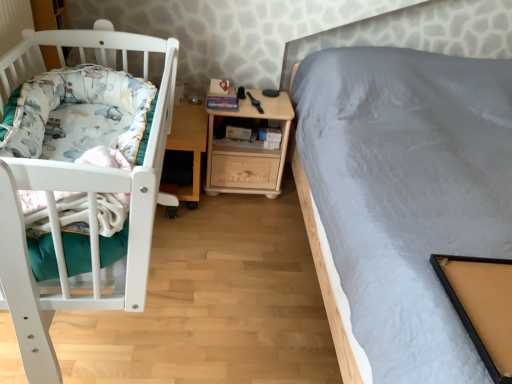
Question: Looking at the image, does white soft blanket at left seem bigger or smaller compared to wooden nightstand at center?

Choices:
 (A) big
 (B) small

Answer: (A)

Question: Is white soft blanket at left wider or thinner than wooden nightstand at center?

Choices:
 (A) thin
 (B) wide

Answer: (B)

Question: Estimate the real-world distances between objects in this image. Which object is farther from the white soft blanket at left?

Choices:
 (A) wooden nightstand at center
 (B) wooden table at center

Answer: (A)

Question: Based on their relative distances, which object is nearer to the white soft blanket at left?

Choices:
 (A) wooden nightstand at center
 (B) wooden table at center

Answer: (B)